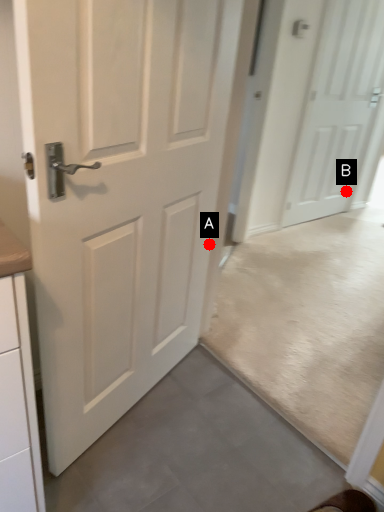
Question: Two points are circled on the image, labeled by A and B beside each circle. Which point is farther from the camera taking this photo?

Choices:
 (A) A is further
 (B) B is further

Answer: (B)